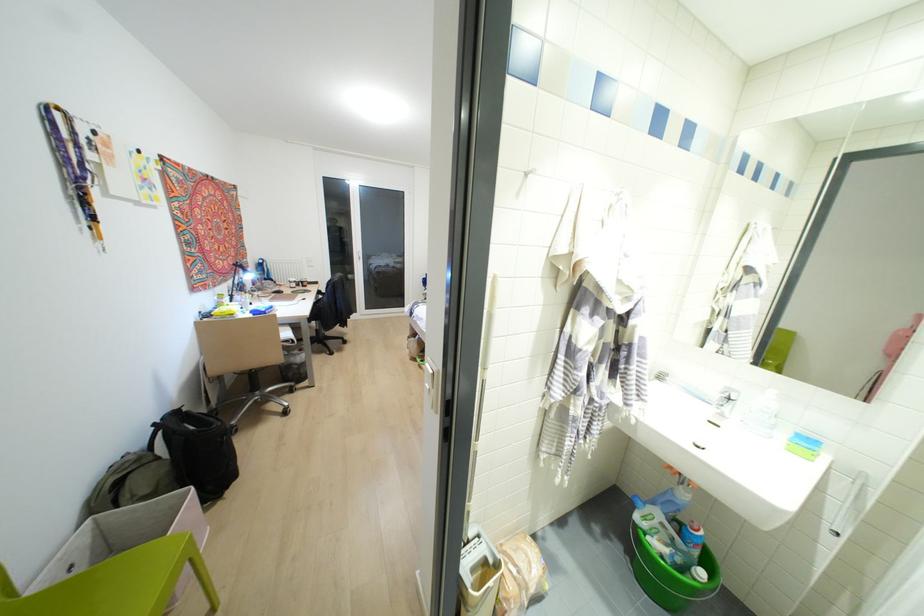
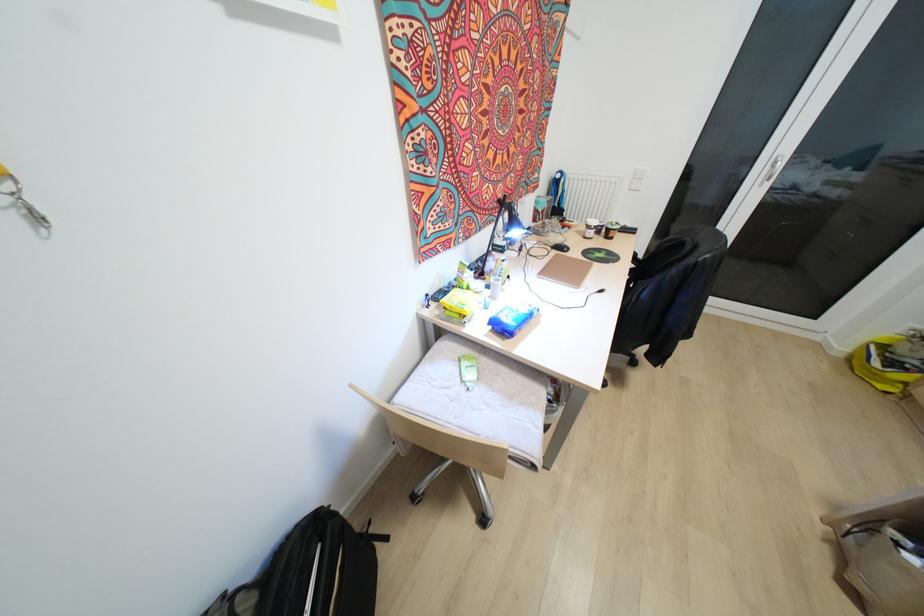
Find the pixel in the second image that matches [271,306] in the first image.

(529, 314)